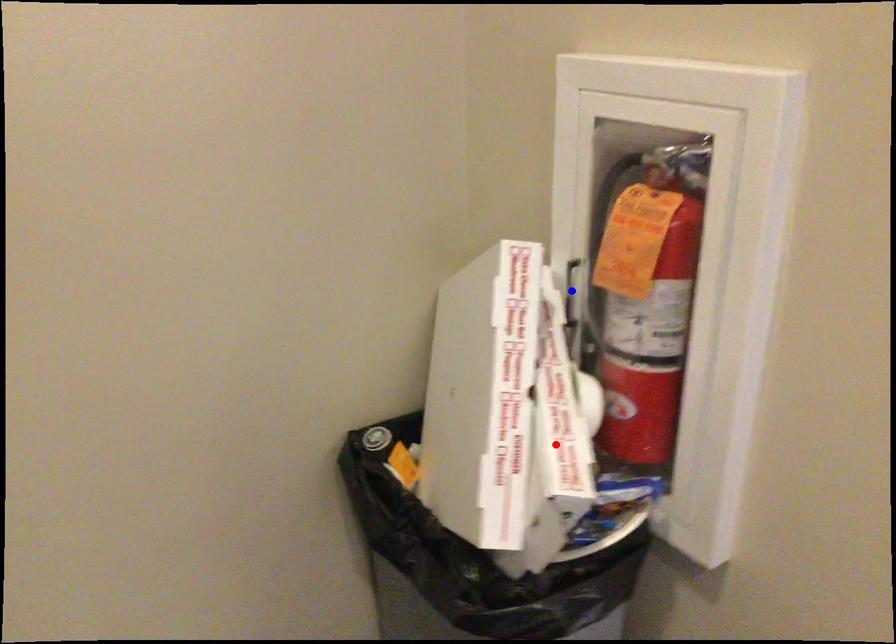
Question: In the image, two points are highlighted. Which point is nearer to the camera? Reply with the corresponding letter.

Choices:
 (A) blue point
 (B) red point

Answer: (B)